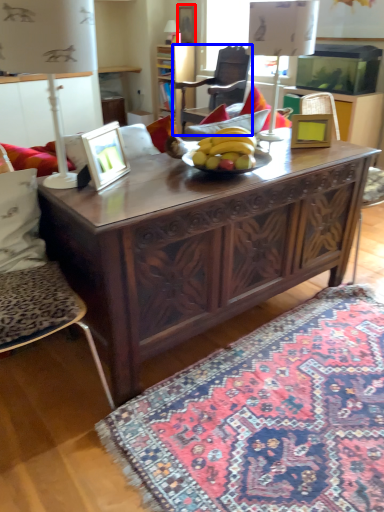
Question: Which of the following is the farthest to the observer, picture frame (highlighted by a red box) or chair (highlighted by a blue box)?

Choices:
 (A) picture frame
 (B) chair

Answer: (A)